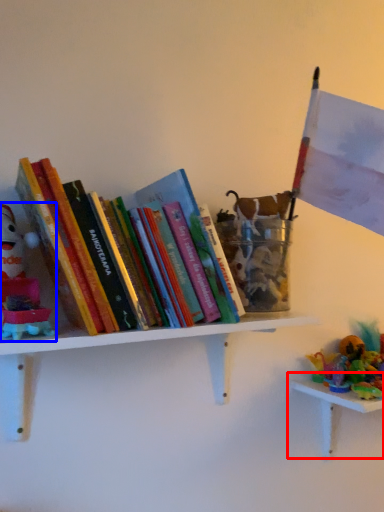
Question: Which object appears closest to the camera in this image, table (highlighted by a red box) or toy (highlighted by a blue box)?

Choices:
 (A) table
 (B) toy

Answer: (B)